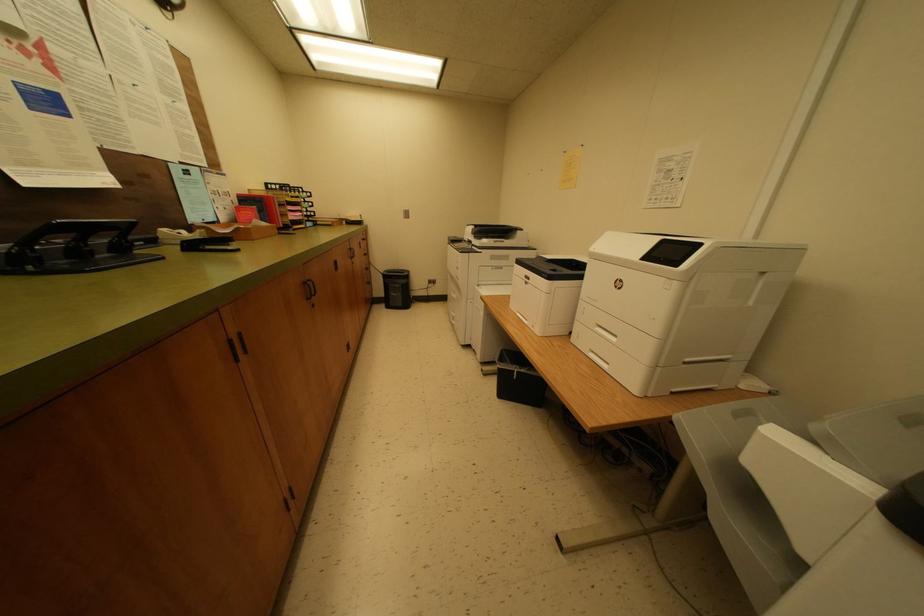
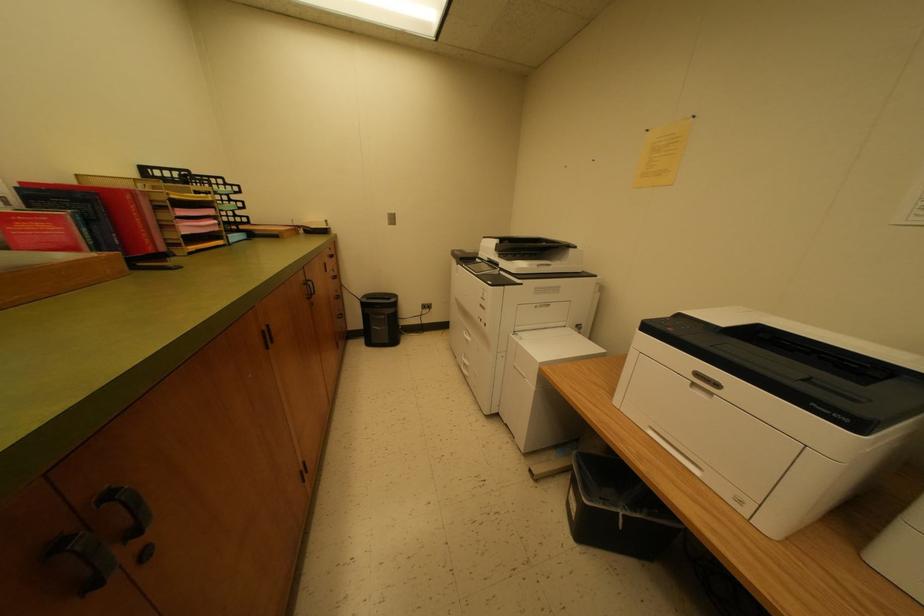
In the scene shown: What movement of the cameraman would produce the second image?

The movement direction of the cameraman is left, forward.